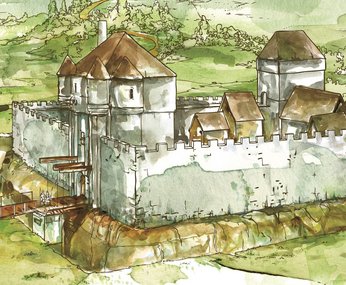
The image size is (346, 285). What are the coordinates of `window` in the screenshot? It's located at (130, 94).